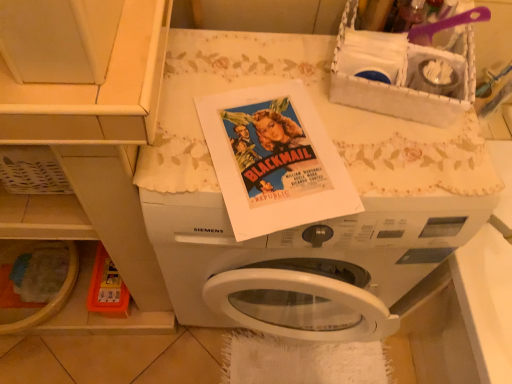
You are a GUI agent. You are given a task and a screenshot of the screen. Output one action in this format:
    pyautogui.click(x=<x>, y=<y>)
    Task: Click on the free space above white matte washing machine at center (from a real-world perspective)
    
    Given the screenshot: What is the action you would take?
    pyautogui.click(x=303, y=133)